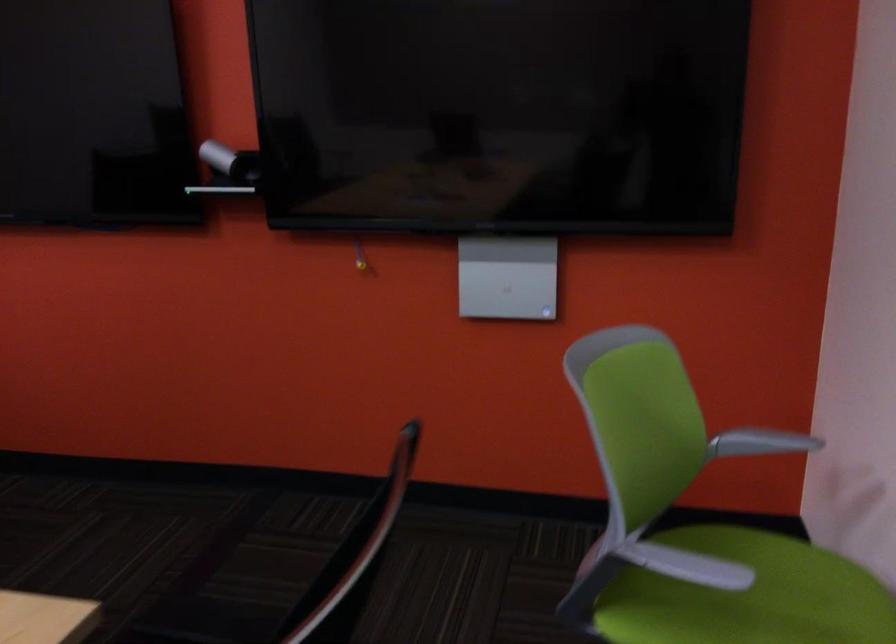
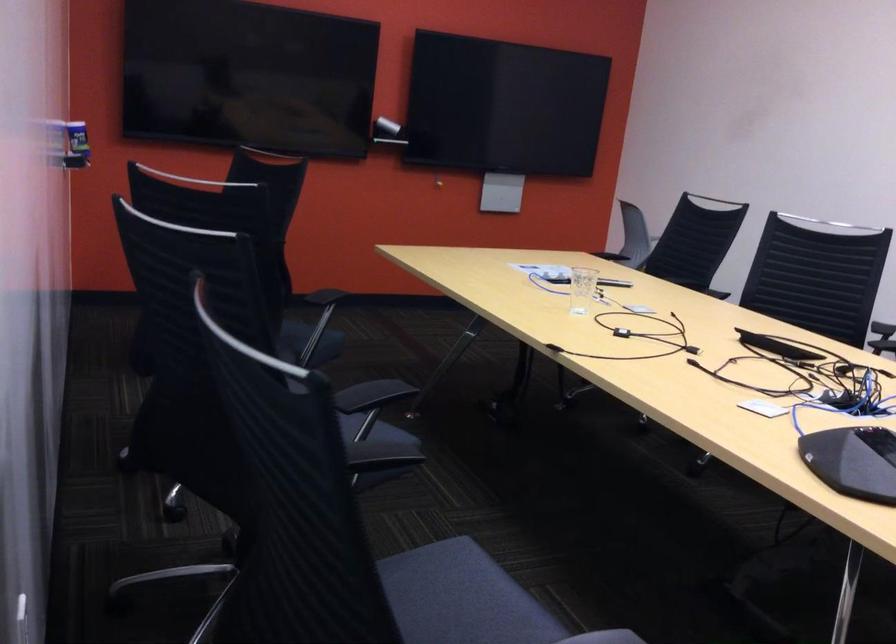
Question: I am providing you with two images of the same scene from different viewpoints. Please identify which objects are invisible in image2.

Choices:
 (A) green chair sitting surface
 (B) green pump dispenser
 (C) black remote control
 (D) blue spray can

Answer: (A)